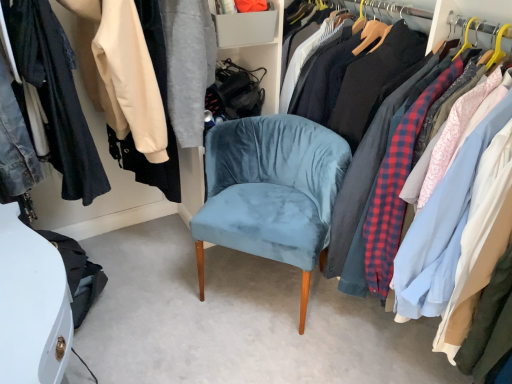
The image size is (512, 384). Identify the location of vacant area in front of velvet blue chair at center. (254, 354).